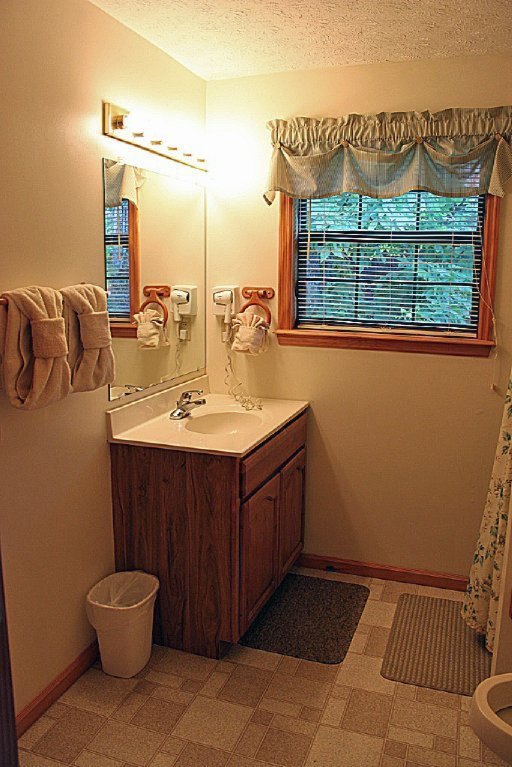
Locate an element on the screen. trash is located at coordinates (129, 657).